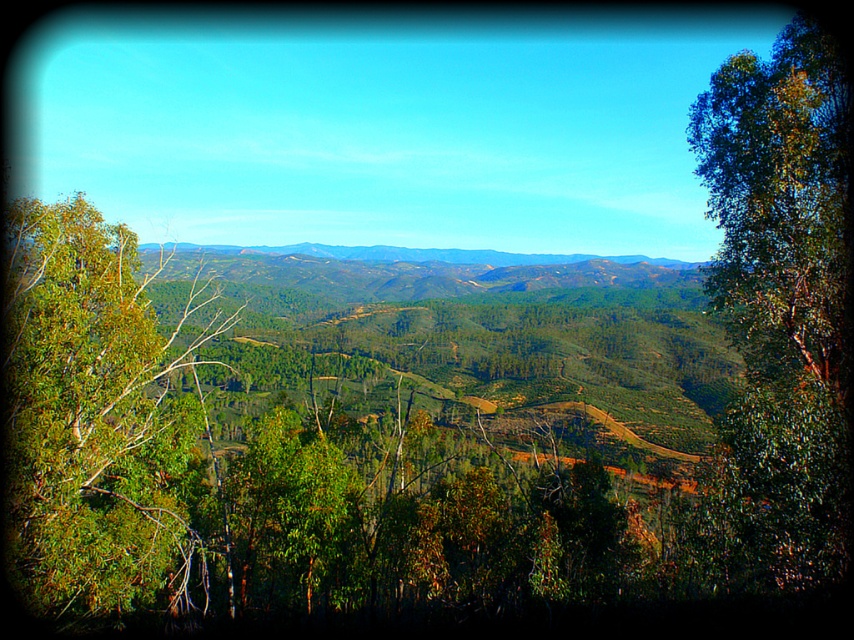
Question: Which object appears farthest from the camera in this image?

Choices:
 (A) green leafy tree at right
 (B) green leafy tree at left

Answer: (B)

Question: Does green leafy tree at right appear over green leafy tree at left?

Choices:
 (A) yes
 (B) no

Answer: (B)

Question: Where is green leafy tree at right located in relation to green leafy tree at left in the image?

Choices:
 (A) above
 (B) below

Answer: (B)

Question: Among these objects, which one is farthest from the camera?

Choices:
 (A) green leafy tree at left
 (B) green leafy tree at right

Answer: (A)

Question: Can you confirm if green leafy tree at right is positioned to the right of green leafy tree at left?

Choices:
 (A) yes
 (B) no

Answer: (A)